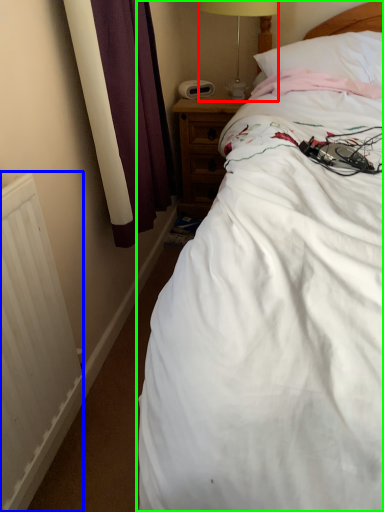
Question: Estimate the real-world distances between objects in this image. Which object is farther from table lamp (highlighted by a red box), radiator (highlighted by a blue box) or bed (highlighted by a green box)?

Choices:
 (A) radiator
 (B) bed

Answer: (A)